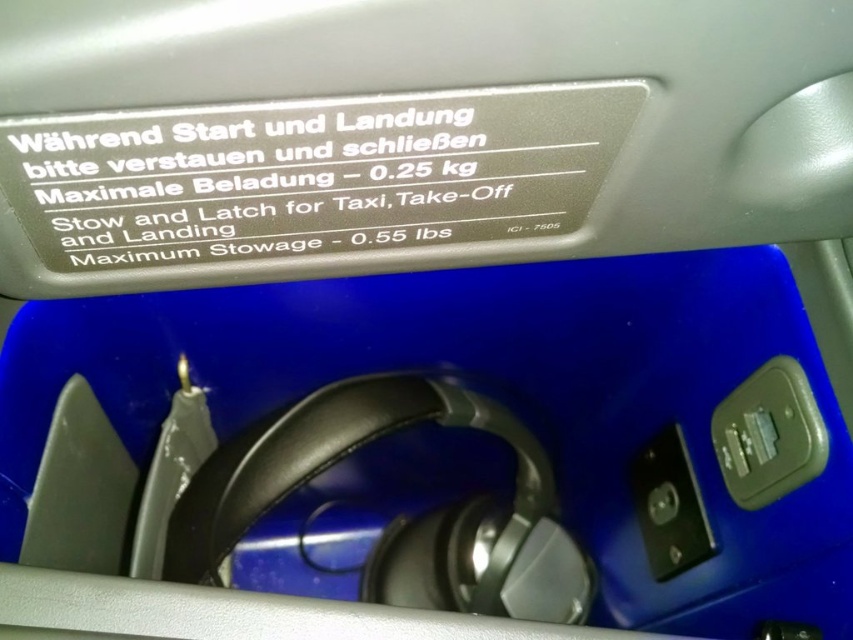
Is matte gray speaker at upper right thinner than metallic silver speaker at lower right?

No.

Who is positioned more to the left, matte gray speaker at upper right or metallic silver speaker at lower right?

metallic silver speaker at lower right

What do you see at coordinates (769, 435) in the screenshot?
I see `matte gray speaker at upper right` at bounding box center [769, 435].

Locate an element on the screen. The image size is (853, 640). matte gray speaker at upper right is located at coordinates (769, 435).